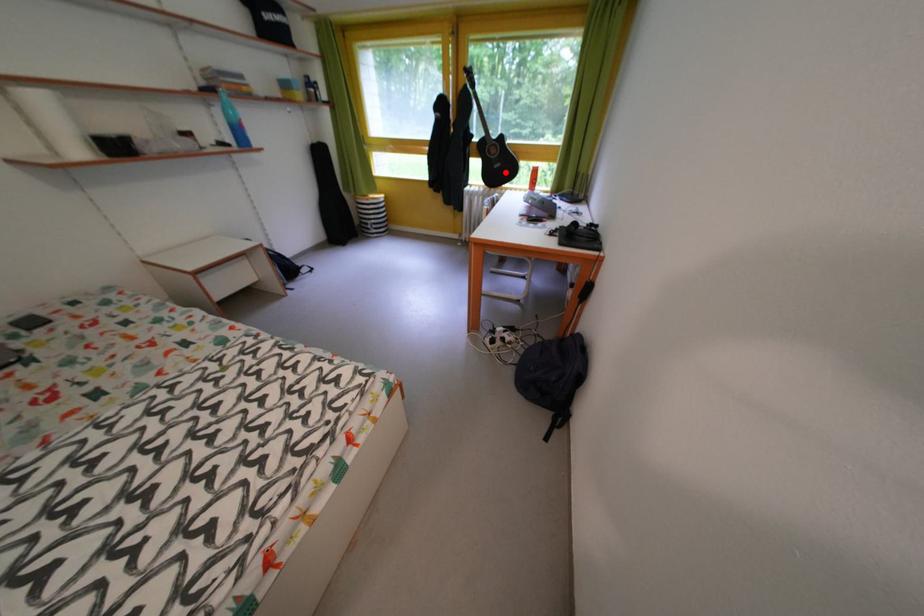
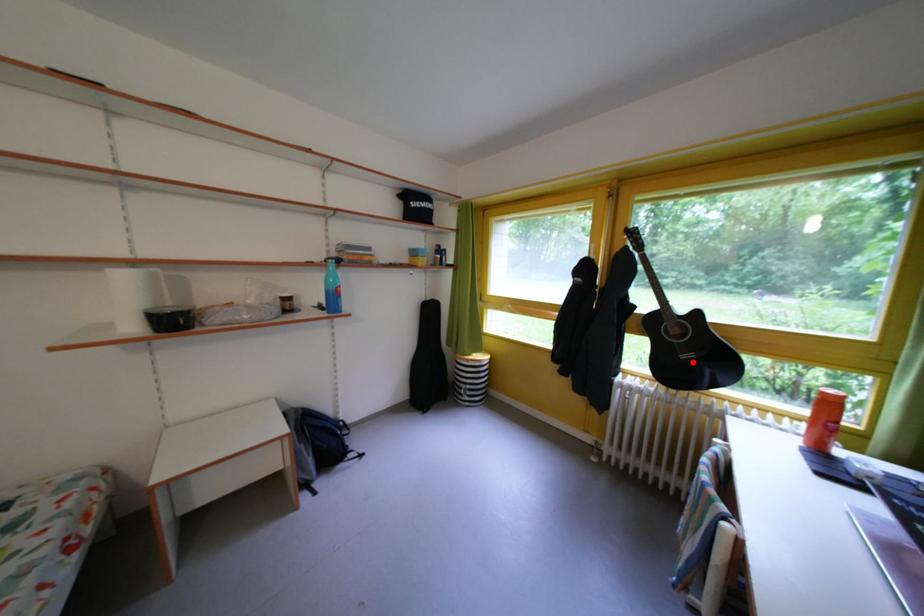
I am providing you with two images of the same scene from different viewpoints. A red point is marked on the first image and another point is marked on the second image. Are the points marked in image1 and image2 representing the same 3D position?

Yes